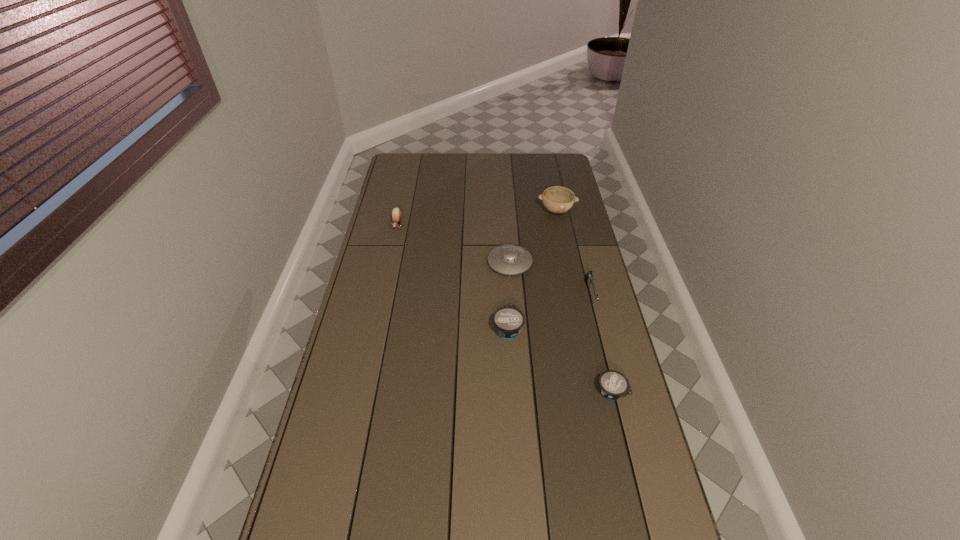
Image resolution: width=960 pixels, height=540 pixels. Identify the location of free space located 0.080m on the right of the saucer. (552, 263).

Where is `free spot located on the front-facing side of the leftmost object`? free spot located on the front-facing side of the leftmost object is located at coordinates (381, 298).

I want to click on vacant space located 0.270m on the back of the tallest object, so click(548, 171).

Find the location of a particular element. free space located 0.380m on the front-facing side of the pistol is located at coordinates [619, 410].

Locate an element on the screen. This screenshot has width=960, height=540. object located in the left edge section of the desktop is located at coordinates (396, 212).

Identify the location of yogurt that is at the right edge. The height and width of the screenshot is (540, 960). click(613, 385).

This screenshot has height=540, width=960. I want to click on bowl that is at the right edge, so click(x=556, y=199).

Where is `pistol that is at the right edge`? Image resolution: width=960 pixels, height=540 pixels. pistol that is at the right edge is located at coordinates (589, 277).

Where is `free space at the far edge`? free space at the far edge is located at coordinates (462, 164).

I want to click on vacant space at the near edge of the desktop, so click(x=516, y=529).